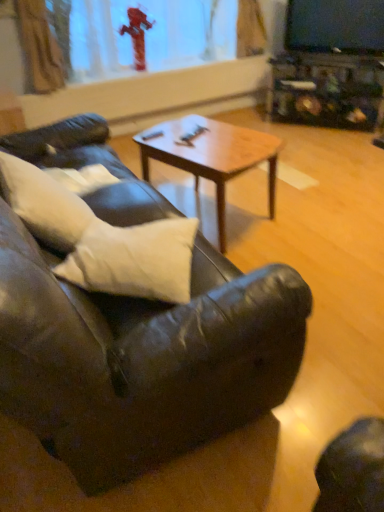
Question: Is the surface of woodenmaterial/texturecoffee table at center in direct contact with transparent glass fire hydrant at upper center?

Choices:
 (A) no
 (B) yes

Answer: (A)

Question: Can you confirm if woodenmaterial/texturecoffee table at center is thinner than transparent glass fire hydrant at upper center?

Choices:
 (A) yes
 (B) no

Answer: (B)

Question: Is woodenmaterial/texturecoffee table at center shorter than transparent glass fire hydrant at upper center?

Choices:
 (A) yes
 (B) no

Answer: (A)

Question: Does woodenmaterial/texturecoffee table at center turn towards transparent glass fire hydrant at upper center?

Choices:
 (A) no
 (B) yes

Answer: (A)

Question: Is woodenmaterial/texturecoffee table at center positioned before transparent glass fire hydrant at upper center?

Choices:
 (A) no
 (B) yes

Answer: (B)

Question: Considering the relative positions of leather couch at center and transparent glass fire hydrant at upper center in the image provided, is leather couch at center to the left or to the right of transparent glass fire hydrant at upper center?

Choices:
 (A) left
 (B) right

Answer: (A)

Question: Is leather couch at center taller or shorter than transparent glass fire hydrant at upper center?

Choices:
 (A) short
 (B) tall

Answer: (B)

Question: Considering the positions of leather couch at center and transparent glass fire hydrant at upper center in the image, is leather couch at center wider or thinner than transparent glass fire hydrant at upper center?

Choices:
 (A) wide
 (B) thin

Answer: (A)

Question: Is leather couch at center inside or outside of transparent glass fire hydrant at upper center?

Choices:
 (A) outside
 (B) inside

Answer: (A)

Question: Is woodenmaterial/texturecoffee table at center taller or shorter than white matte pillow at left, acting as the 1th pillow starting from the left?

Choices:
 (A) tall
 (B) short

Answer: (B)

Question: Looking at the image, does woodenmaterial/texturecoffee table at center seem bigger or smaller compared to white matte pillow at left, acting as the second pillow starting from the right?

Choices:
 (A) big
 (B) small

Answer: (A)

Question: Looking at their shapes, would you say woodenmaterial/texturecoffee table at center is wider or thinner than white matte pillow at left, acting as the 1th pillow starting from the left?

Choices:
 (A) wide
 (B) thin

Answer: (A)

Question: From a real-world perspective, is woodenmaterial/texturecoffee table at center above or below white matte pillow at left, acting as the second pillow starting from the right?

Choices:
 (A) above
 (B) below

Answer: (B)

Question: Relative to white matte pillow at left, acting as the second pillow starting from the right, is transparent glass fire hydrant at upper center in front or behind?

Choices:
 (A) behind
 (B) front

Answer: (A)

Question: Considering the positions of point (208, 51) and point (67, 215), is point (208, 51) closer or farther from the camera than point (67, 215)?

Choices:
 (A) closer
 (B) farther

Answer: (B)